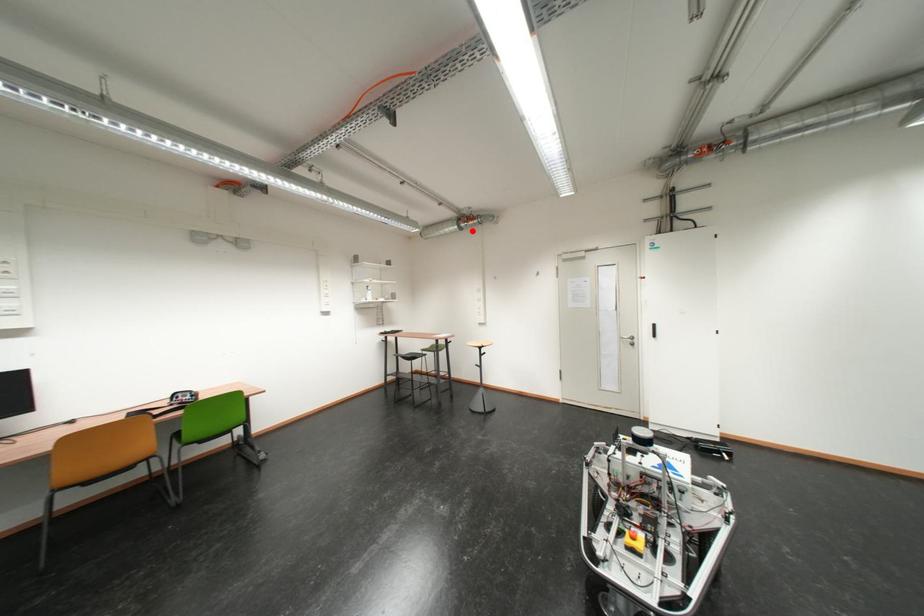
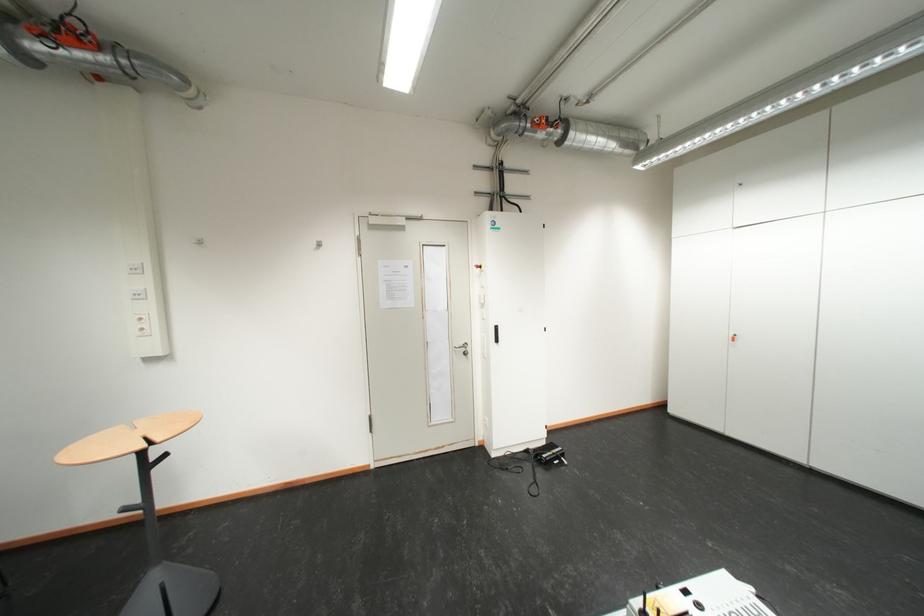
In the second image, find the point that corresponds to the highlighted location in the first image.

(35, 60)